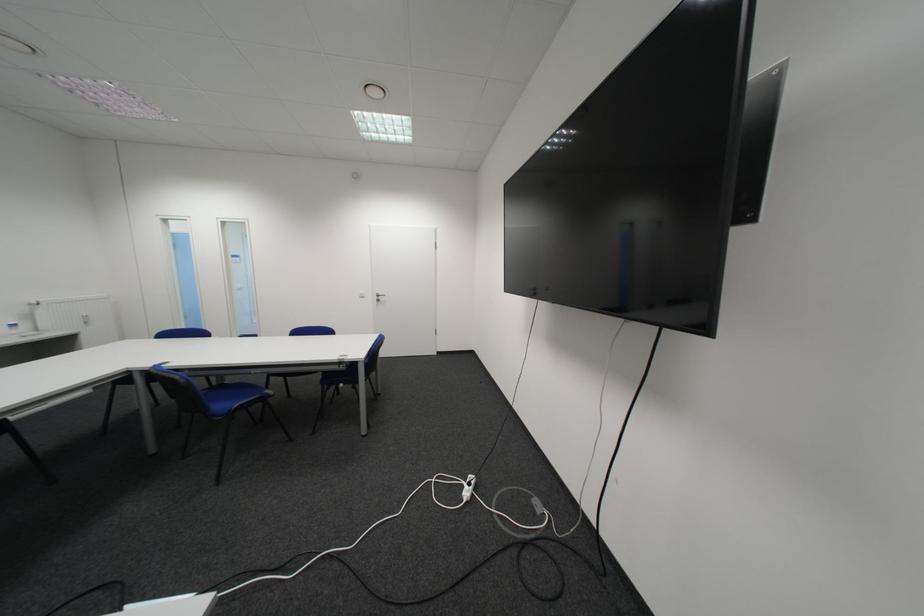
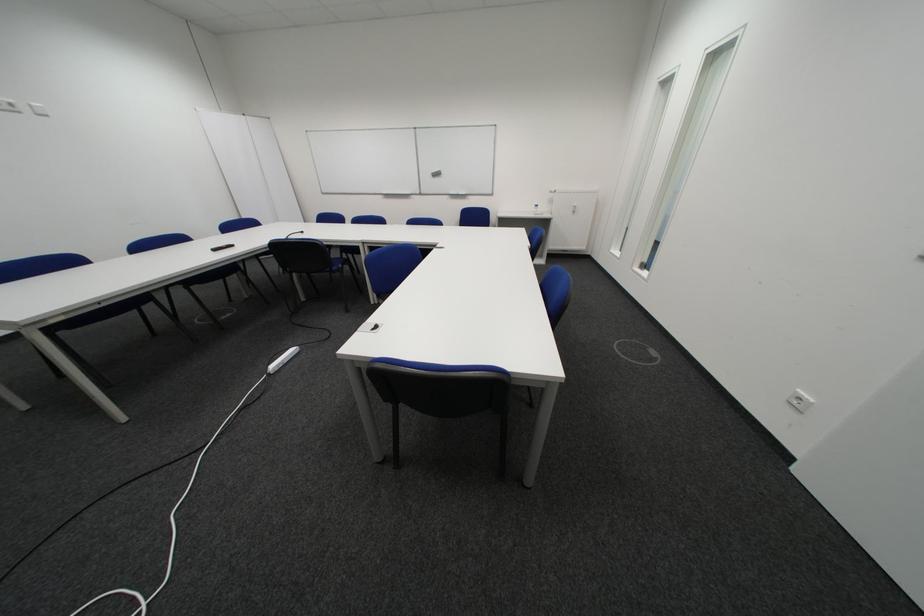
The point at [38,336] is marked in the first image. Where is the corresponding point in the second image?

(548, 215)